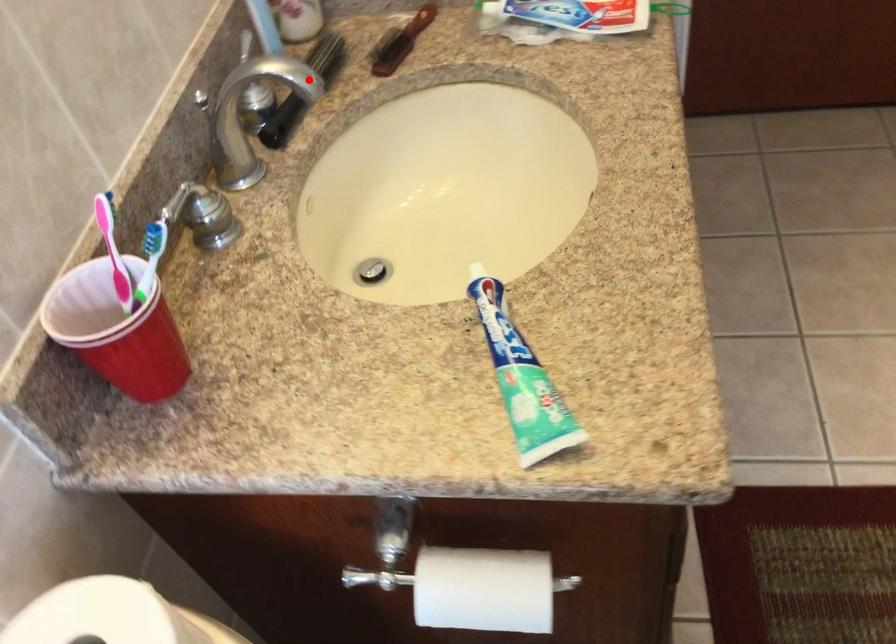
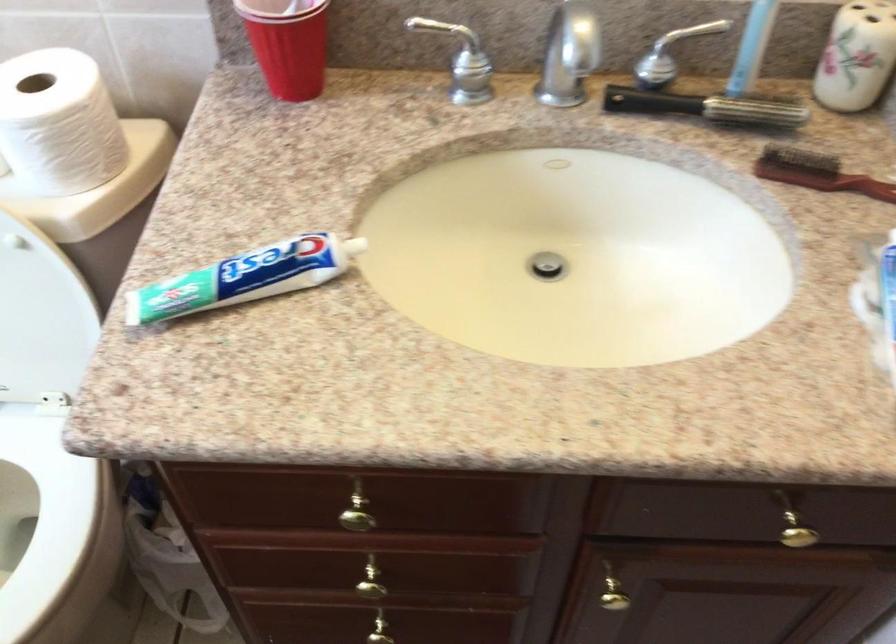
In the second image, find the point that corresponds to the highlighted location in the first image.

(707, 107)